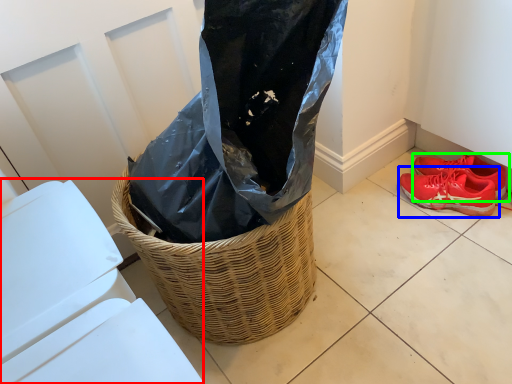
Question: Which object is the farthest from lift (highlighted by a red box)? Choose among these: footwear (highlighted by a blue box) or footwear (highlighted by a green box).

Choices:
 (A) footwear
 (B) footwear

Answer: (B)